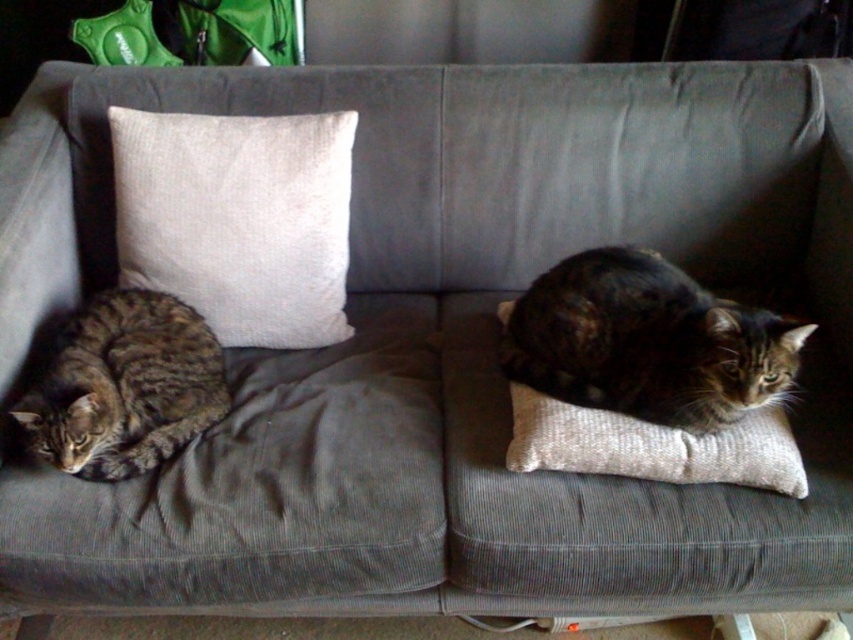
Question: Which is nearer to the tabby fur cat at left?

Choices:
 (A) tabby fur cat at center
 (B) white textured pillow at upper left

Answer: (B)

Question: Which point appears closest to the camera in this image?

Choices:
 (A) (233, 340)
 (B) (227, 394)
 (C) (741, 388)

Answer: (C)

Question: Is the position of white textured pillow at upper left less distant than that of tabby fur cat at center?

Choices:
 (A) no
 (B) yes

Answer: (A)

Question: Does white textured pillow at upper left appear under tabby fur cat at left?

Choices:
 (A) yes
 (B) no

Answer: (B)

Question: Observing the image, what is the correct spatial positioning of tabby fur cat at center in reference to tabby fur cat at left?

Choices:
 (A) below
 (B) above

Answer: (B)

Question: Estimate the real-world distances between objects in this image. Which object is closer to the tabby fur cat at left?

Choices:
 (A) tabby fur cat at center
 (B) white textured pillow at upper left

Answer: (B)